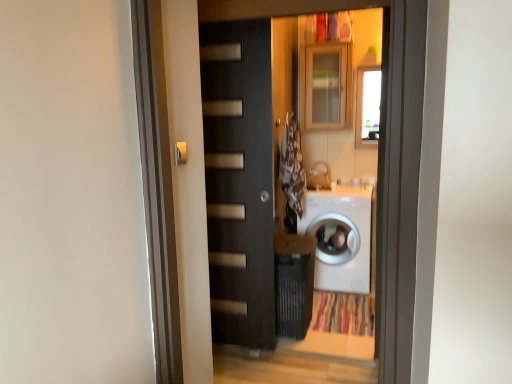
Question: From a real-world perspective, is metallic silver door handle at upper center on top of wooden cabinet at upper center?

Choices:
 (A) no
 (B) yes

Answer: (A)

Question: Is metallic silver door handle at upper center wider than wooden cabinet at upper center?

Choices:
 (A) yes
 (B) no

Answer: (B)

Question: Is metallic silver door handle at upper center thinner than wooden cabinet at upper center?

Choices:
 (A) no
 (B) yes

Answer: (B)

Question: From a real-world perspective, is metallic silver door handle at upper center located beneath wooden cabinet at upper center?

Choices:
 (A) yes
 (B) no

Answer: (A)

Question: Can you confirm if metallic silver door handle at upper center is smaller than wooden cabinet at upper center?

Choices:
 (A) no
 (B) yes

Answer: (B)

Question: Is matte black door at center inside the boundaries of metallic silver door handle at upper center, or outside?

Choices:
 (A) inside
 (B) outside

Answer: (B)

Question: From the image's perspective, is matte black door at center above or below metallic silver door handle at upper center?

Choices:
 (A) below
 (B) above

Answer: (A)

Question: In the image, is matte black door at center on the left side or the right side of metallic silver door handle at upper center?

Choices:
 (A) left
 (B) right

Answer: (B)

Question: Considering the positions of matte black door at center and metallic silver door handle at upper center in the image, is matte black door at center wider or thinner than metallic silver door handle at upper center?

Choices:
 (A) thin
 (B) wide

Answer: (B)

Question: Is white glossy washing machine at center wider or thinner than brown fabric laundry at center?

Choices:
 (A) wide
 (B) thin

Answer: (A)

Question: From the image's perspective, relative to brown fabric laundry at center, is white glossy washing machine at center above or below?

Choices:
 (A) above
 (B) below

Answer: (B)

Question: Relative to brown fabric laundry at center, is white glossy washing machine at center in front or behind?

Choices:
 (A) front
 (B) behind

Answer: (B)

Question: In terms of height, does white glossy washing machine at center look taller or shorter compared to brown fabric laundry at center?

Choices:
 (A) short
 (B) tall

Answer: (B)

Question: In terms of height, does matte black door at center look taller or shorter compared to white glossy washing machine at center?

Choices:
 (A) short
 (B) tall

Answer: (B)

Question: From a real-world perspective, is matte black door at center positioned above or below white glossy washing machine at center?

Choices:
 (A) above
 (B) below

Answer: (A)